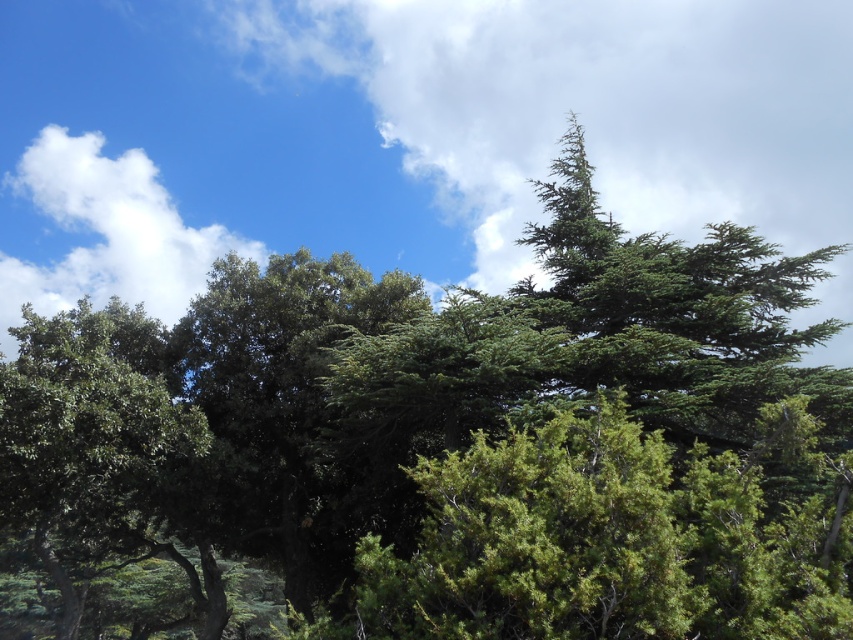
You are a bird flying over the green matte tree at left and the white fluffy cloud at upper left. Which object is taller?

The white fluffy cloud at upper left is taller than the green matte tree at left according to the description.

You are standing in the natural outdoor scene described. You see two points marked in the image. One is at point (90, 616) and the other is at point (94, 256). Which point is closer to you?

Point (90, 616) is in front of point (94, 256), so it is closer to you.